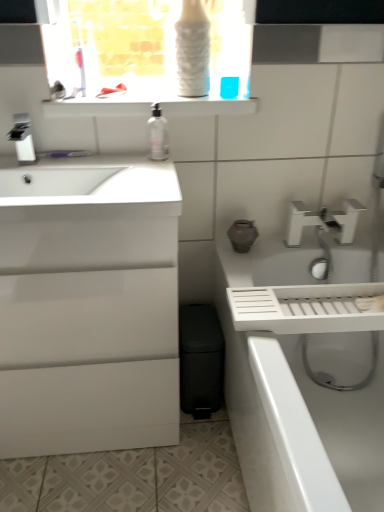
Identify the location of free space to the right of satin nickel faucet at upper left, arranged as the 2th tap when viewed from the back. (78, 161).